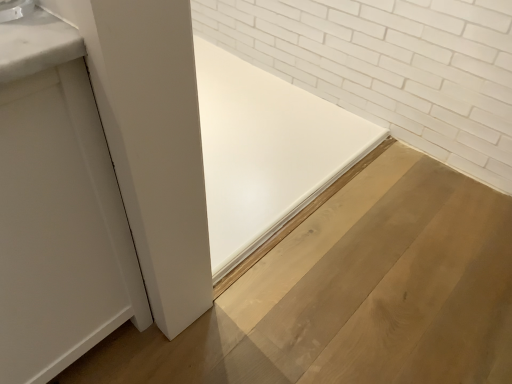
Question: Is the surface of white matte door at left in direct contact with satin nickel faucet at upper left?

Choices:
 (A) yes
 (B) no

Answer: (B)

Question: Can you confirm if white matte door at left is shorter than satin nickel faucet at upper left?

Choices:
 (A) no
 (B) yes

Answer: (A)

Question: Can you confirm if white matte door at left is bigger than satin nickel faucet at upper left?

Choices:
 (A) yes
 (B) no

Answer: (A)

Question: Is the position of white matte door at left less distant than that of satin nickel faucet at upper left?

Choices:
 (A) no
 (B) yes

Answer: (B)

Question: Is white matte door at left oriented towards satin nickel faucet at upper left?

Choices:
 (A) yes
 (B) no

Answer: (B)

Question: From the image's perspective, is white matte door at left on top of satin nickel faucet at upper left?

Choices:
 (A) no
 (B) yes

Answer: (A)

Question: From the image's perspective, is natural wood plywood at center located above white matte door at left?

Choices:
 (A) no
 (B) yes

Answer: (A)

Question: From a real-world perspective, is natural wood plywood at center over white matte door at left?

Choices:
 (A) yes
 (B) no

Answer: (B)

Question: Does natural wood plywood at center appear on the left side of white matte door at left?

Choices:
 (A) yes
 (B) no

Answer: (B)

Question: Does natural wood plywood at center have a larger size compared to white matte door at left?

Choices:
 (A) yes
 (B) no

Answer: (B)

Question: Is natural wood plywood at center in contact with white matte door at left?

Choices:
 (A) no
 (B) yes

Answer: (A)

Question: Would you say natural wood plywood at center is outside white matte door at left?

Choices:
 (A) no
 (B) yes

Answer: (B)

Question: Is white matte door at left in contact with natural wood plywood at center?

Choices:
 (A) no
 (B) yes

Answer: (A)